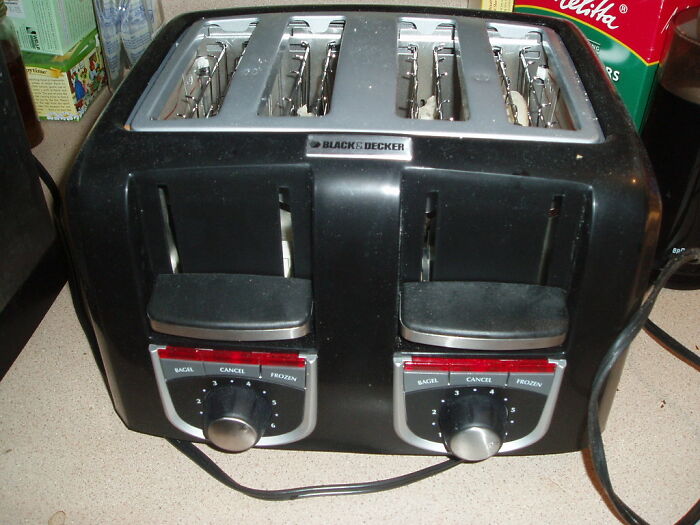
The height and width of the screenshot is (525, 700). I want to click on cooking dial, so click(232, 418), click(482, 425).